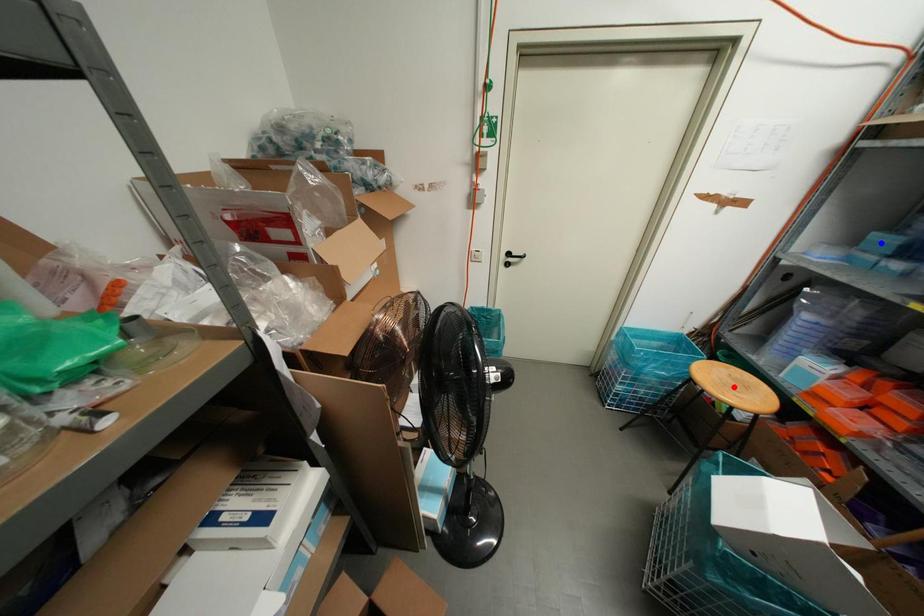
Question: Two points are marked on the image. Which point is closer to the camera?

Choices:
 (A) Blue point is closer.
 (B) Red point is closer.

Answer: (A)